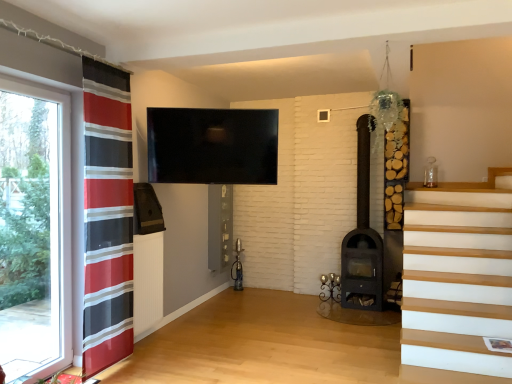
Question: From a real-world perspective, is dark brown wood-burning stove at center-right above or below red striped curtain at left?

Choices:
 (A) below
 (B) above

Answer: (A)

Question: Is dark brown wood-burning stove at center-right inside or outside of red striped curtain at left?

Choices:
 (A) inside
 (B) outside

Answer: (B)

Question: Considering the real-world distances, which object is farthest from the red striped curtain at left?

Choices:
 (A) transparent glass window at left
 (B) dark brown wood-burning stove at center-right

Answer: (B)

Question: Which of these objects is positioned closest to the red striped curtain at left?

Choices:
 (A) transparent glass window at left
 (B) dark brown wood-burning stove at center-right

Answer: (A)